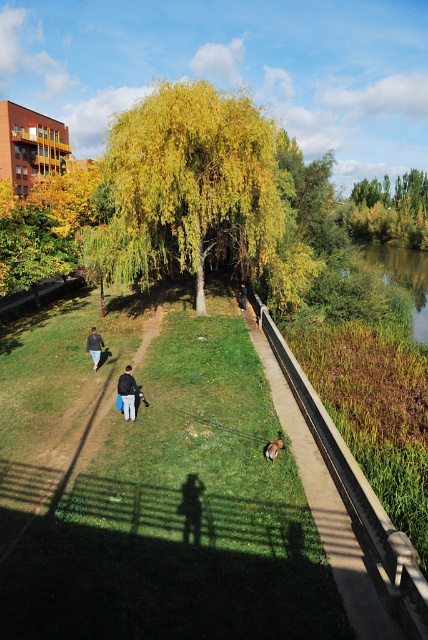
Question: Which is farther from the green grass at center?

Choices:
 (A) green leafy tree at upper center
 (B) dark gray fabric at center

Answer: (A)

Question: Does green leafy tree at upper center appear on the left side of dark blue jeans at lower left?

Choices:
 (A) yes
 (B) no

Answer: (B)

Question: Among these objects, which one is nearest to the camera?

Choices:
 (A) dark blue fabric jacket at center
 (B) dark gray fabric at center
 (C) green leafy tree at upper center
 (D) dark blue jeans at lower left

Answer: (A)

Question: Can you confirm if dark blue fabric jacket at center is positioned above dark gray fabric at center?

Choices:
 (A) yes
 (B) no

Answer: (B)

Question: Does yellow-green leaves at center have a lesser width compared to dark blue fabric jacket at center?

Choices:
 (A) yes
 (B) no

Answer: (B)

Question: Estimate the real-world distances between objects in this image. Which object is closer to the brown concrete path at center?

Choices:
 (A) dark blue jeans at lower left
 (B) dark blue fabric jacket at center

Answer: (B)